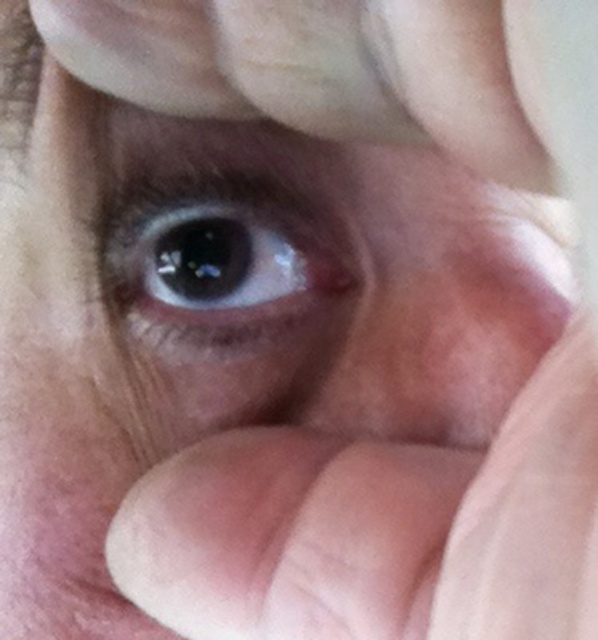
You are a makeup artist trying to apply eyeliner precisely between the smooth skin at center and the fingers covering the lower eyelid. How far apart are these two areas?

The smooth skin at center and the fingers covering the lower eyelid are 6.35 inches apart.

Consider the image. You are a dermatologist analyzing the image of an eye and its surrounding area. You notice a point labeled as point (288, 536). Based on the information provided, what type of skin texture is present at that specific point?

The point (288, 536) has smooth skin at center.